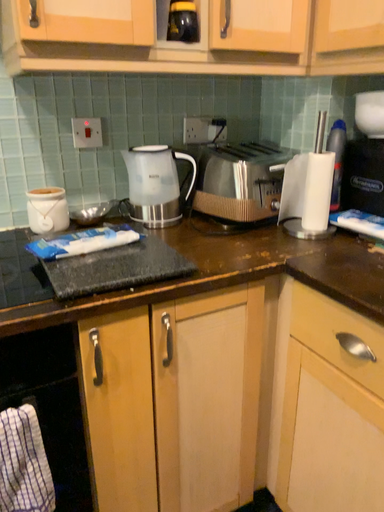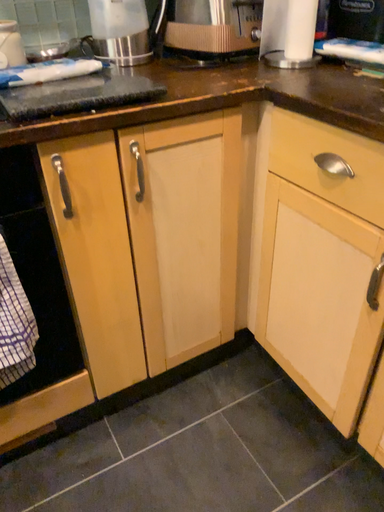
Question: Which way did the camera rotate in the video?

Choices:
 (A) rotated downward
 (B) rotated upward

Answer: (A)